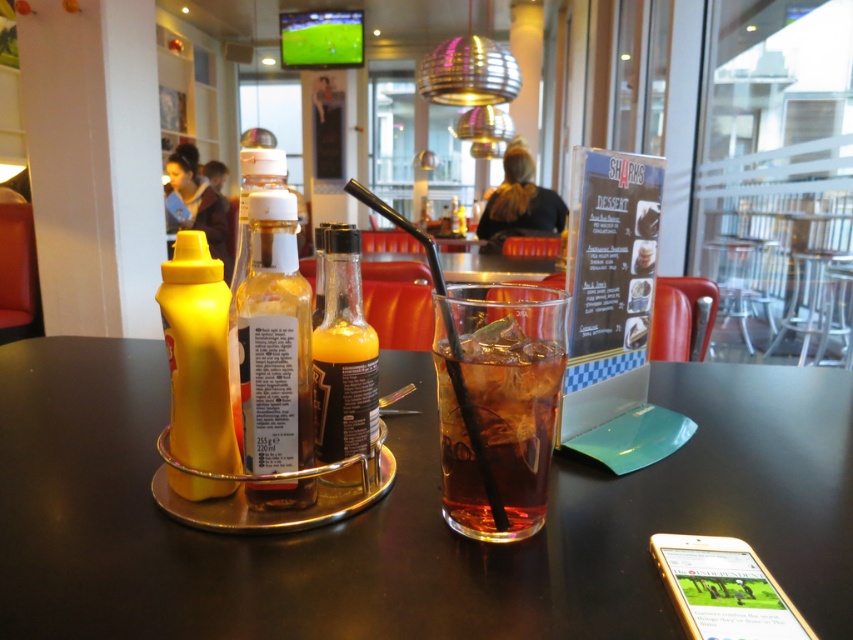
Question: Among these objects, which one is farthest from the camera?

Choices:
 (A) translucent glass bottle at center
 (B) yellow matte squeeze bottle at left

Answer: (A)

Question: Based on their relative distances, which object is nearer to the translucent plastic bottle at center?

Choices:
 (A) translucent glass at center
 (B) translucent glass bottle at center
 (C) yellow matte squeeze bottle at left

Answer: (B)

Question: Is translucent glass at center above translucent glass bottle at center?

Choices:
 (A) yes
 (B) no

Answer: (B)

Question: Observing the image, what is the correct spatial positioning of translucent plastic bottle at center in reference to yellow matte squeeze bottle at left?

Choices:
 (A) above
 (B) below

Answer: (B)

Question: Is the position of translucent glass at center more distant than that of translucent glass bottle at center?

Choices:
 (A) yes
 (B) no

Answer: (B)

Question: Which point is closer to the camera taking this photo?

Choices:
 (A) (169, 282)
 (B) (368, 468)
 (C) (492, 516)
 (D) (207, 545)

Answer: (D)